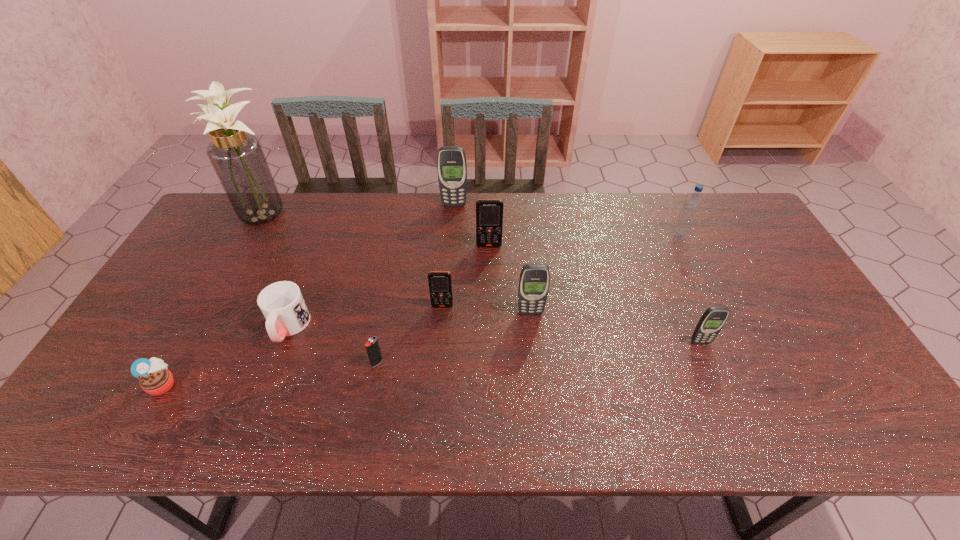
Find the location of `flower arrangement`. flower arrangement is located at coordinates (237, 157).

Image resolution: width=960 pixels, height=540 pixels. I want to click on green flower arrangement, so click(x=237, y=157).

At what (x,y) coordinates should I click in order to perform the action: click on the farthest cellular telephone. Please return your answer as a coordinate pair (x, y). The image size is (960, 540). Looking at the image, I should click on (451, 163).

Where is `the farthest gray cellular telephone`? The width and height of the screenshot is (960, 540). the farthest gray cellular telephone is located at coordinates (451, 163).

Find the location of a particular element. This screenshot has height=540, width=960. water bottle is located at coordinates (691, 206).

Find the location of a particular element. Image resolution: width=960 pixels, height=540 pixels. the rightmost object is located at coordinates (x=691, y=206).

Where is `the third object from right to left`? The height and width of the screenshot is (540, 960). the third object from right to left is located at coordinates (534, 281).

The height and width of the screenshot is (540, 960). What are the coordinates of `the second nearest cellular telephone` in the screenshot? It's located at (534, 281).

Where is `the right orange cellular telephone`? the right orange cellular telephone is located at coordinates (489, 212).

Locate an element on the screen. The image size is (960, 540). the fourth nearest cellular telephone is located at coordinates (489, 212).